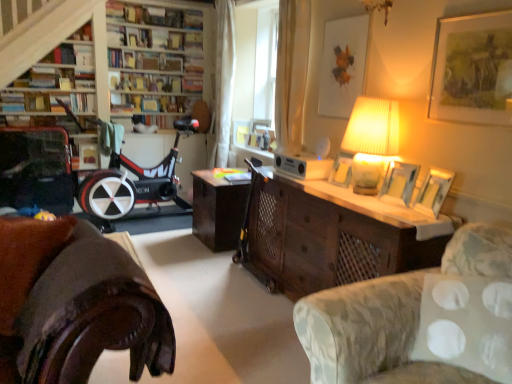
The width and height of the screenshot is (512, 384). Identify the location of vacant space to the left of matte yellow lampshade at upper right. (321, 192).